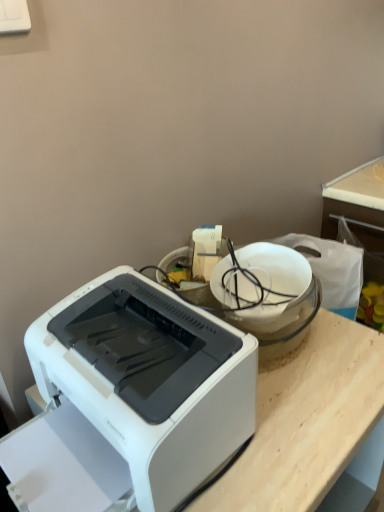
What do you see at coordinates (149, 380) in the screenshot? I see `white plastic printer at lower left` at bounding box center [149, 380].

This screenshot has width=384, height=512. I want to click on white plastic printer at lower left, so click(x=149, y=380).

What do you see at coordinates (281, 323) in the screenshot? This screenshot has height=512, width=384. I see `white glossy bowl at upper center` at bounding box center [281, 323].

Locate an element on the screen. Image resolution: width=384 pixels, height=512 pixels. white glossy bowl at upper center is located at coordinates (281, 323).

Find the location of `white plastic printer at lower left`. white plastic printer at lower left is located at coordinates (149, 380).

Is white plastic printer at lower left to the right of white glossy bowl at upper center from the viewer's perspective?

No, white plastic printer at lower left is not to the right of white glossy bowl at upper center.

Which object is further away from the camera, white plastic printer at lower left or white glossy bowl at upper center?

white glossy bowl at upper center is further from the camera.

Which is in front, point (113, 315) or point (240, 325)?

The point (113, 315) is closer.

From the image's perspective, is white plastic printer at lower left over white glossy bowl at upper center?

No, from the image's perspective, white plastic printer at lower left is not on top of white glossy bowl at upper center.

From a real-world perspective, is white plastic printer at lower left under white glossy bowl at upper center?

Yes, from a real-world perspective, white plastic printer at lower left is below white glossy bowl at upper center.

Which object is thinner, white plastic printer at lower left or white glossy bowl at upper center?

white glossy bowl at upper center is thinner.

Considering the sizes of objects white plastic printer at lower left and white glossy bowl at upper center in the image provided, who is taller, white plastic printer at lower left or white glossy bowl at upper center?

Standing taller between the two is white plastic printer at lower left.

Is white plastic printer at lower left smaller than white glossy bowl at upper center?

Incorrect, white plastic printer at lower left is not smaller in size than white glossy bowl at upper center.

Choose the correct answer: Is white plastic printer at lower left inside white glossy bowl at upper center or outside it?

white plastic printer at lower left lies outside white glossy bowl at upper center.

Is white plastic printer at lower left with white glossy bowl at upper center?

white plastic printer at lower left and white glossy bowl at upper center are not in contact.

Is white glossy bowl at upper center at the back of white plastic printer at lower left?

Yes, white glossy bowl at upper center is at the back of white plastic printer at lower left.

What's the angular difference between white plastic printer at lower left and white glossy bowl at upper center's facing directions?

white plastic printer at lower left and white glossy bowl at upper center are facing 8.8e-05 degrees away from each other.

Measure the distance from white plastic printer at lower left to white glossy bowl at upper center.

white plastic printer at lower left and white glossy bowl at upper center are 9.82 inches apart.

Identify the location of printer that appears below the white glossy bowl at upper center (from the image's perspective). (149, 380).

Is white glossy bowl at upper center to the right of white plastic printer at lower left from the viewer's perspective?

Yes, white glossy bowl at upper center is to the right of white plastic printer at lower left.

Which is in front, white glossy bowl at upper center or white plastic printer at lower left?

Positioned in front is white plastic printer at lower left.

Which is behind, point (320, 295) or point (252, 348)?

The point (320, 295) is behind.

From the image's perspective, is white glossy bowl at upper center above white plastic printer at lower left?

Indeed, from the image's perspective, white glossy bowl at upper center is shown above white plastic printer at lower left.

From a real-world perspective, is white glossy bowl at upper center over white plastic printer at lower left?

Yes.

In terms of width, does white glossy bowl at upper center look wider or thinner when compared to white plastic printer at lower left?

Considering their sizes, white glossy bowl at upper center looks slimmer than white plastic printer at lower left.

Is white glossy bowl at upper center shorter than white plastic printer at lower left?

Yes, white glossy bowl at upper center is shorter than white plastic printer at lower left.

Based on the photo, based on their sizes in the image, would you say white glossy bowl at upper center is bigger or smaller than white plastic printer at lower left?

Clearly, white glossy bowl at upper center is smaller in size than white plastic printer at lower left.

Which is correct: white glossy bowl at upper center is inside white plastic printer at lower left, or outside of it?

white glossy bowl at upper center is not enclosed by white plastic printer at lower left.

Is white glossy bowl at upper center with white plastic printer at lower left?

white glossy bowl at upper center and white plastic printer at lower left are not in contact.

Is white glossy bowl at upper center oriented towards white plastic printer at lower left?

Yes, white glossy bowl at upper center is facing white plastic printer at lower left.

What are the coordinates of `appliance located above the white plastic printer at lower left (from the image's perspective)` in the screenshot? It's located at coord(281,323).

The height and width of the screenshot is (512, 384). I want to click on printer on the left of white glossy bowl at upper center, so point(149,380).

Where is `printer below the white glossy bowl at upper center (from a real-world perspective)`? The width and height of the screenshot is (384, 512). printer below the white glossy bowl at upper center (from a real-world perspective) is located at coordinates (149, 380).